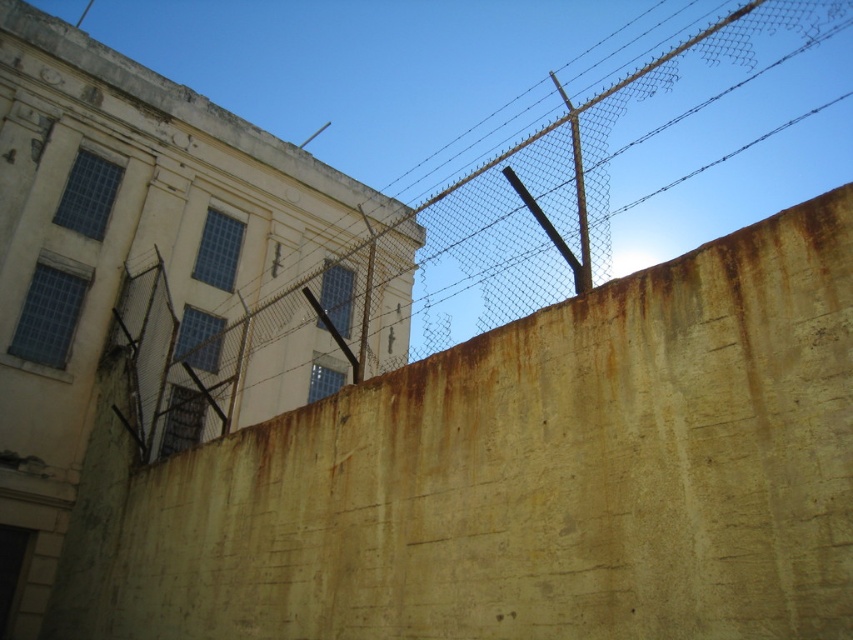
Does rusty concrete wall at lower left have a smaller size compared to rusty concrete fence at upper right?

Correct, rusty concrete wall at lower left occupies less space than rusty concrete fence at upper right.

Is rusty concrete wall at lower left taller than rusty concrete fence at upper right?

No.

Describe the element at coordinates (517, 476) in the screenshot. I see `rusty concrete wall at lower left` at that location.

At what (x,y) coordinates should I click in order to perform the action: click on rusty concrete wall at lower left. Please return your answer as a coordinate pair (x, y). Looking at the image, I should click on (517, 476).